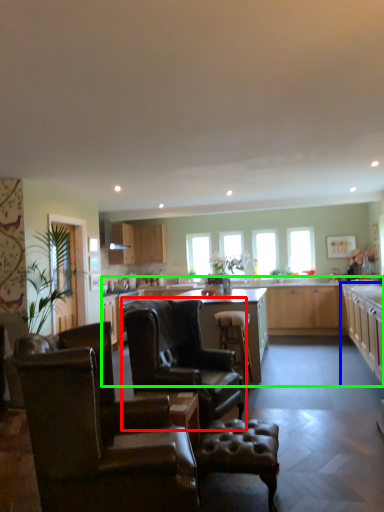
Question: Which object is the farthest from chair (highlighted by a red box)? Choose among these: cabinetry (highlighted by a blue box) or countertop (highlighted by a green box).

Choices:
 (A) cabinetry
 (B) countertop

Answer: (B)